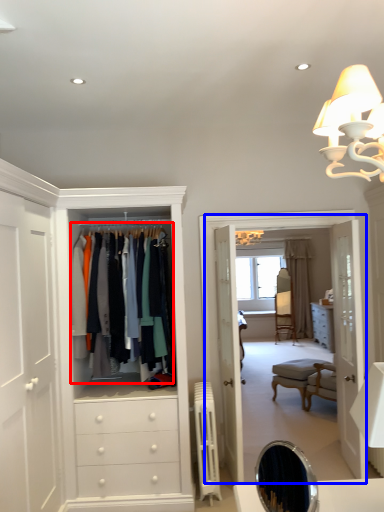
Question: Among these objects, which one is nearest to the camera, clothing (highlighted by a red box) or boutique (highlighted by a blue box)?

Choices:
 (A) clothing
 (B) boutique

Answer: (A)